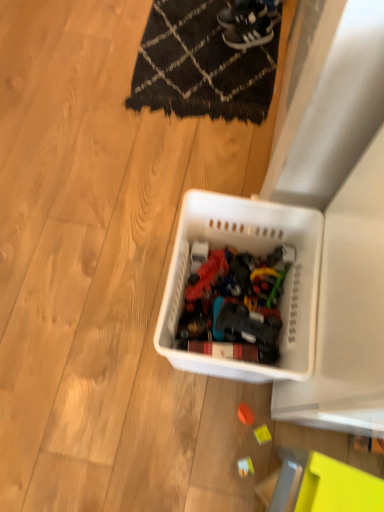
In order to click on free location in front of yellow plastic toy at lower right, the second toy viewed from the top in this screenshot , I will do `click(247, 478)`.